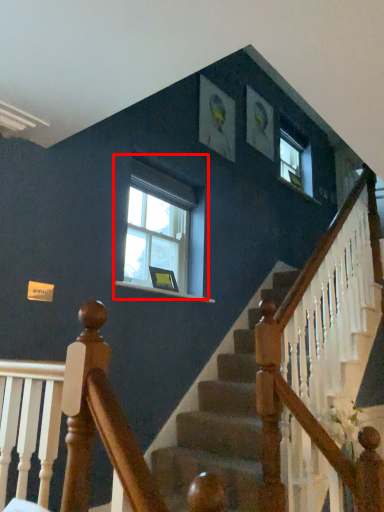
Question: From the image's perspective, what is the correct spatial relationship of window (annotated by the red box) in relation to picture frame?

Choices:
 (A) above
 (B) below

Answer: (A)